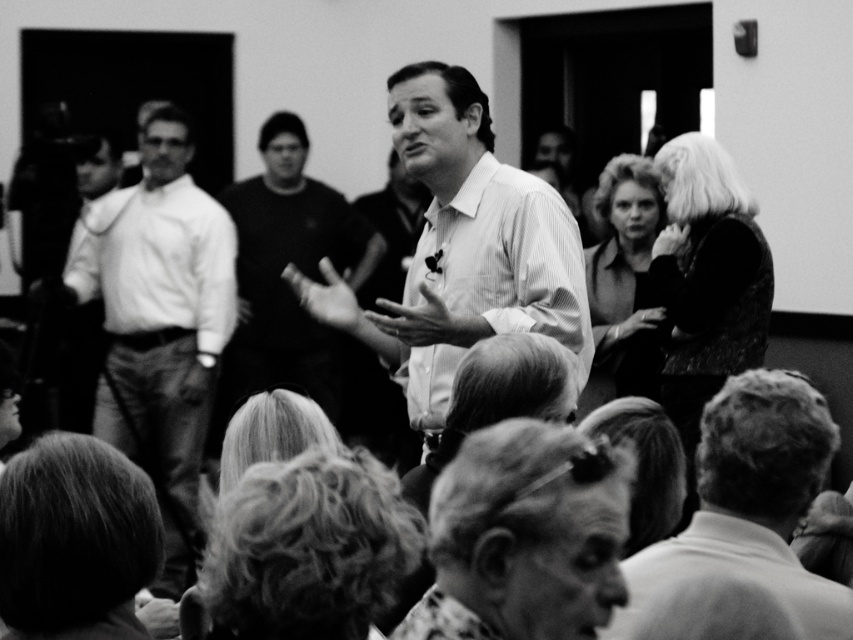
Question: Is smooth white shirt at left above gray hair at lower center?

Choices:
 (A) no
 (B) yes

Answer: (B)

Question: Does curly hair at center appear on the left side of white shirt at center?

Choices:
 (A) no
 (B) yes

Answer: (A)

Question: Which point is closer to the camera taking this photo?

Choices:
 (A) (268, 554)
 (B) (96, 513)

Answer: (A)

Question: Which point is closer to the camera?

Choices:
 (A) smooth hair at lower left
 (B) velvet black dress at upper right
 (C) white shirt at center

Answer: (A)

Question: Considering the relative positions of smooth white shirt at lower right and smooth hair at lower left in the image provided, where is smooth white shirt at lower right located with respect to smooth hair at lower left?

Choices:
 (A) right
 (B) left

Answer: (A)

Question: Among these objects, which one is farthest from the camera?

Choices:
 (A) smooth black dress at upper center
 (B) smooth white shirt at left
 (C) velvet black dress at upper right
 (D) curly hair at center

Answer: (B)